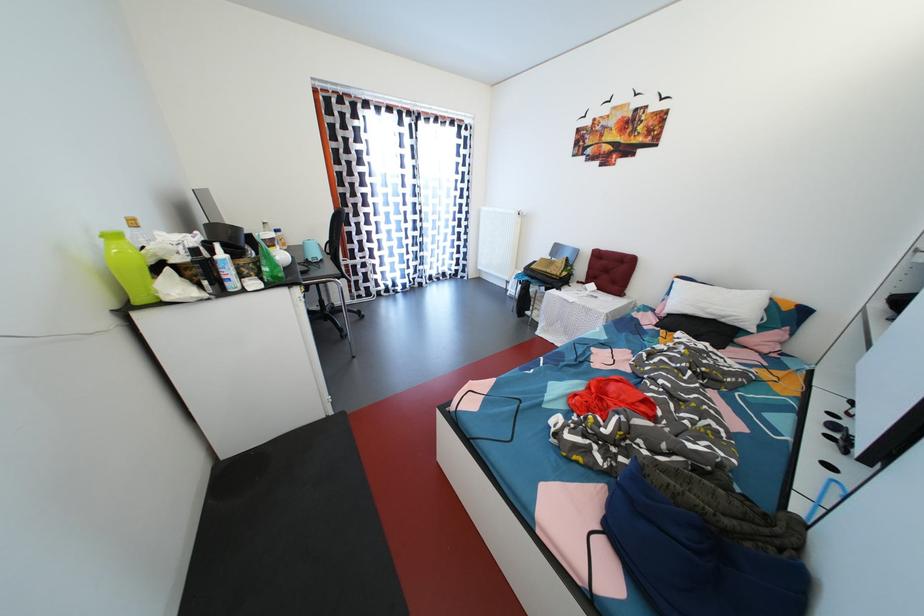
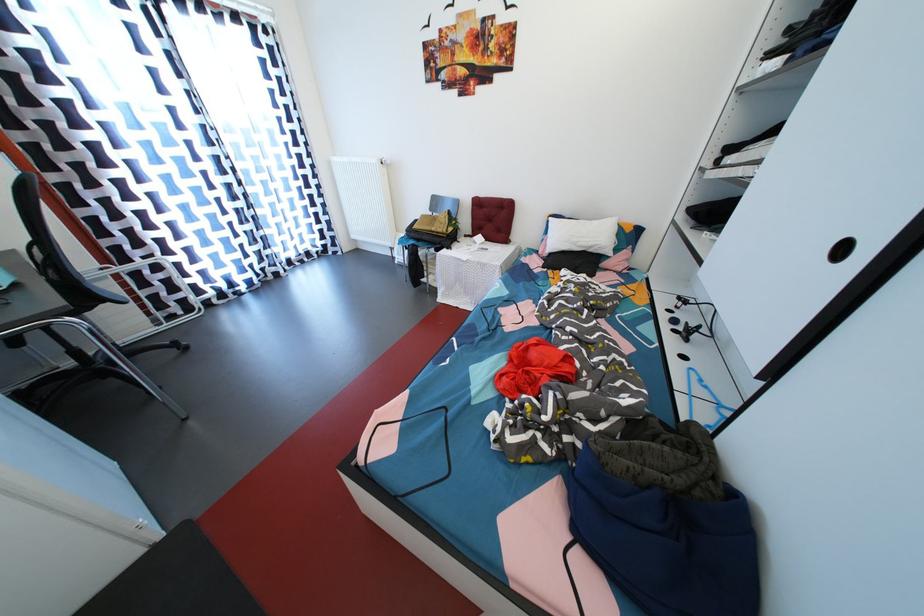
Find the pixel in the second image that matches pixel 610 253 in the first image.

(489, 200)